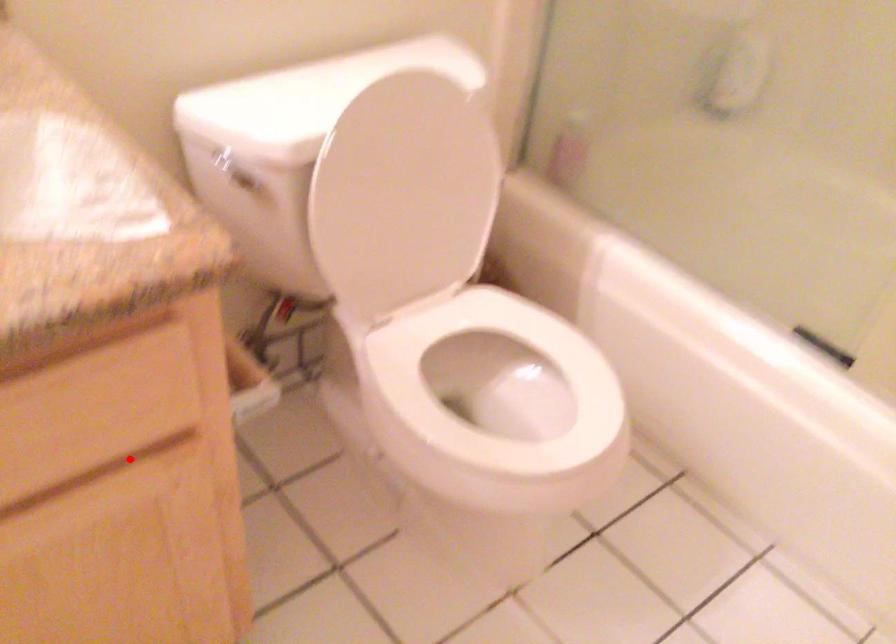
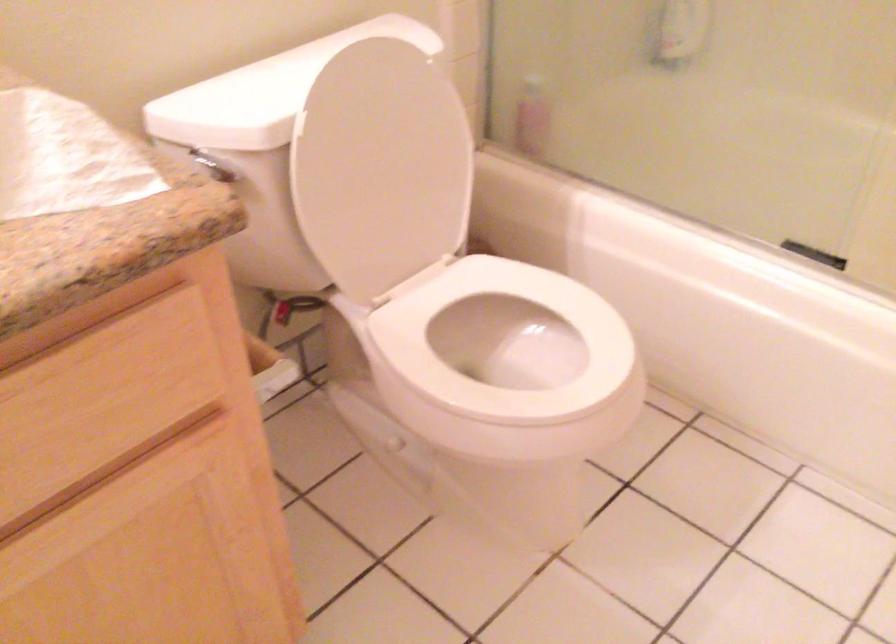
The point at the highlighted location is marked in the first image. Where is the corresponding point in the second image?

(164, 440)